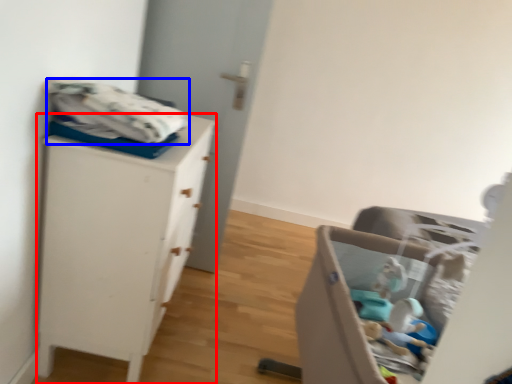
Question: Which object appears farthest to the camera in this image, chest of drawers (highlighted by a red box) or baby clothe (highlighted by a blue box)?

Choices:
 (A) chest of drawers
 (B) baby clothe

Answer: (A)